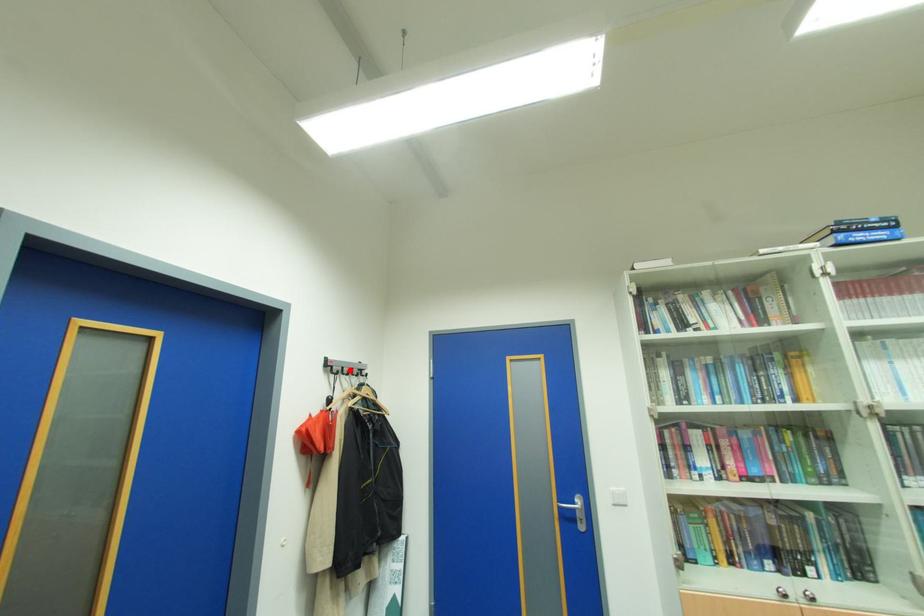
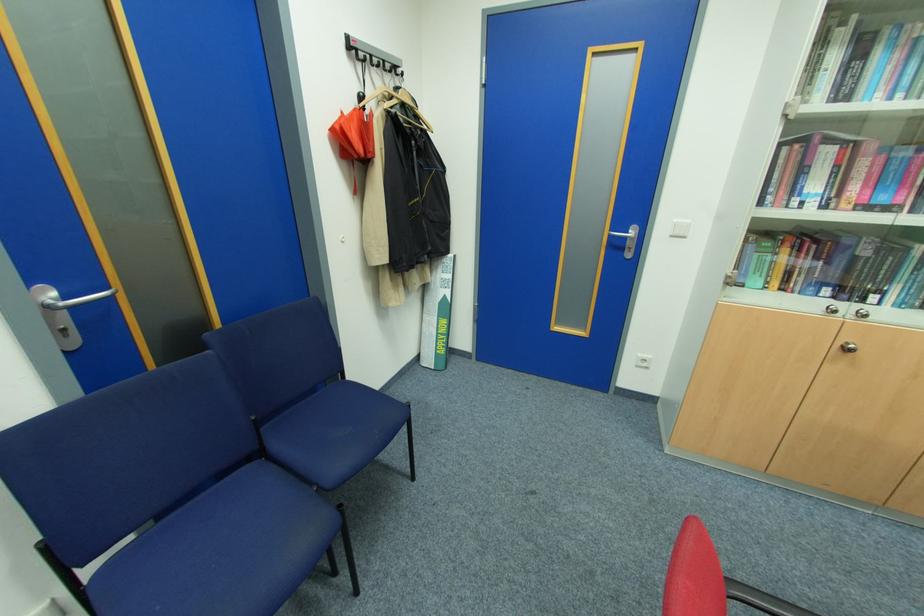
Where in the second image is the point corresponding to the highlighted location from the first image?

(380, 60)